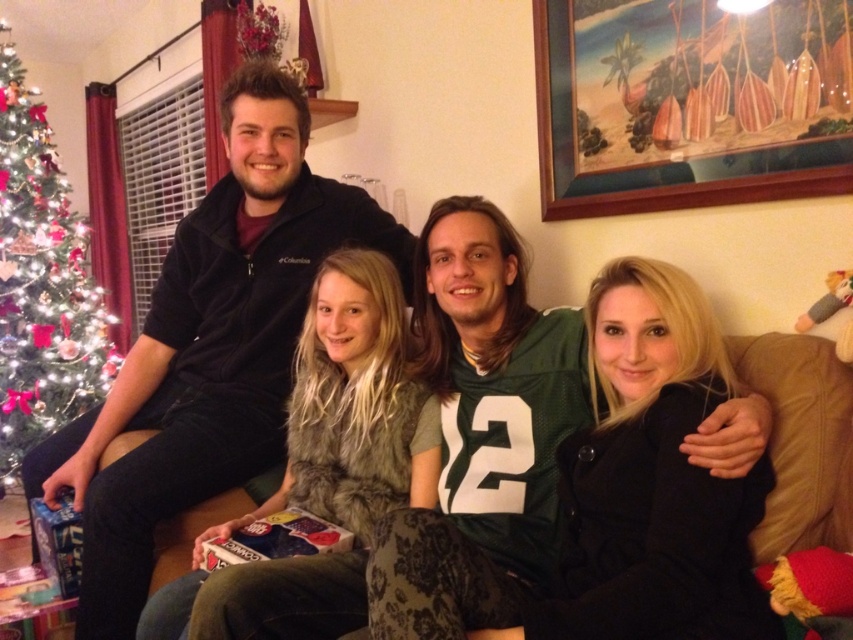
Can you confirm if wooden picture frame at upper right is positioned below green artificial christmas tree at left?

No.

Does point (630, 52) lie in front of point (44, 257)?

Yes, point (630, 52) is in front of point (44, 257).

Does point (566, 33) come farther from viewer compared to point (0, 132)?

That is False.

The height and width of the screenshot is (640, 853). In order to click on wooden picture frame at upper right in this screenshot , I will do `click(689, 104)`.

Is wooden picture frame at upper right shorter than brown fabric couch at center?

No.

Describe the element at coordinates (689, 104) in the screenshot. I see `wooden picture frame at upper right` at that location.

Which is behind, point (619, 52) or point (178, 548)?

The point (619, 52) is more distant.

This screenshot has width=853, height=640. I want to click on wooden picture frame at upper right, so click(x=689, y=104).

This screenshot has width=853, height=640. What do you see at coordinates (42, 282) in the screenshot?
I see `green artificial christmas tree at left` at bounding box center [42, 282].

Who is more forward, (77, 324) or (160, 541)?

Point (160, 541)

Who is more forward, (13, 356) or (161, 563)?

Point (161, 563) is more forward.

Identify the location of green artificial christmas tree at left. (42, 282).